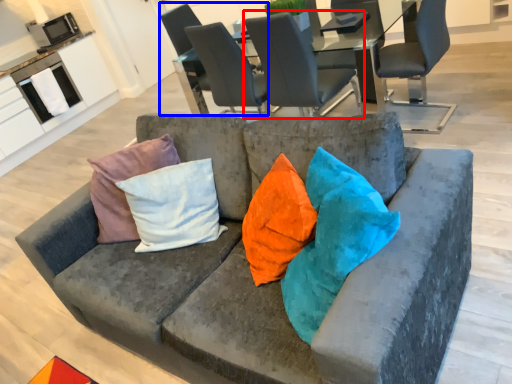
Question: Which object appears closest to the camera in this image, chair (highlighted by a red box) or chair (highlighted by a blue box)?

Choices:
 (A) chair
 (B) chair

Answer: (A)